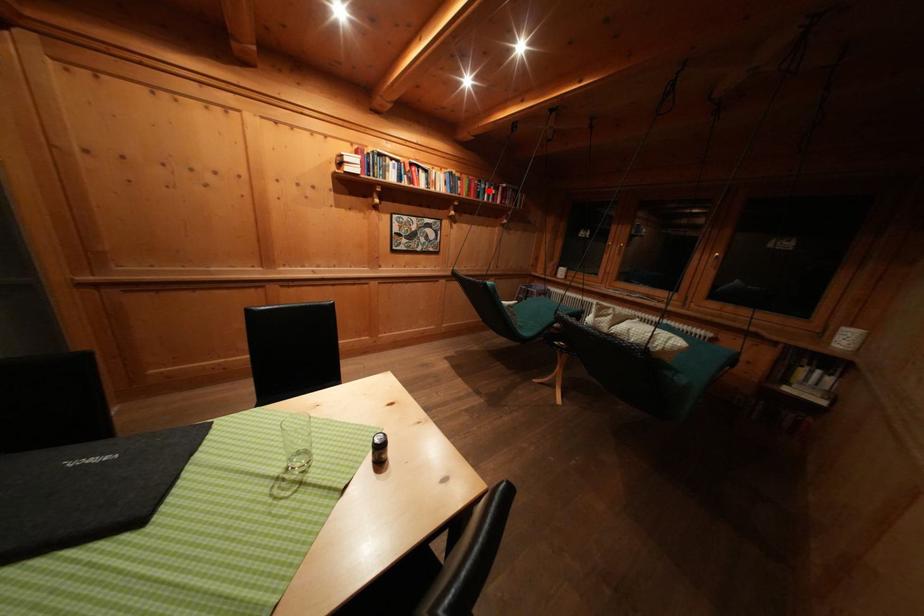
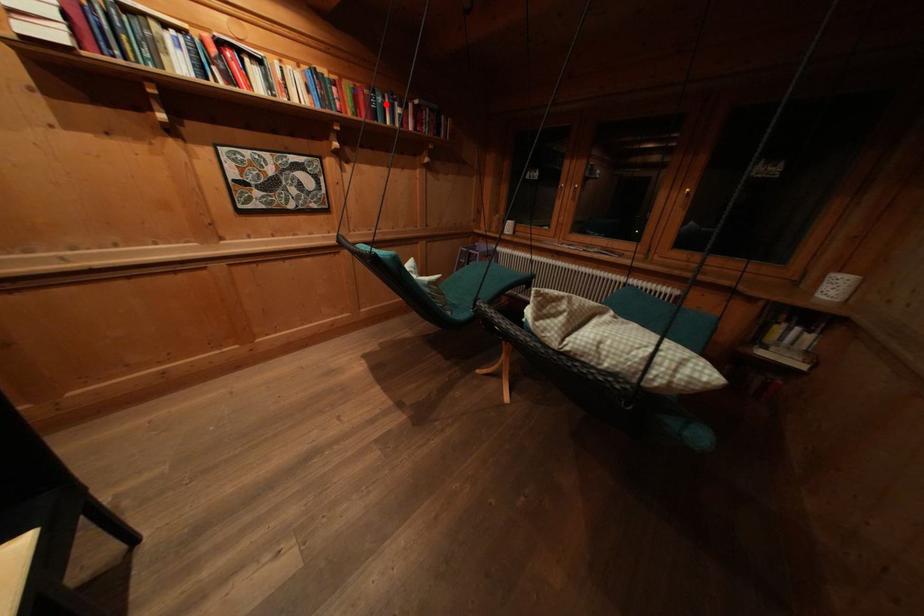
I am providing you with two images of the same scene from different viewpoints. A red point is marked on the first image and another point is marked on the second image. Are the points marked in image1 and image2 representing the same 3D position?

Yes